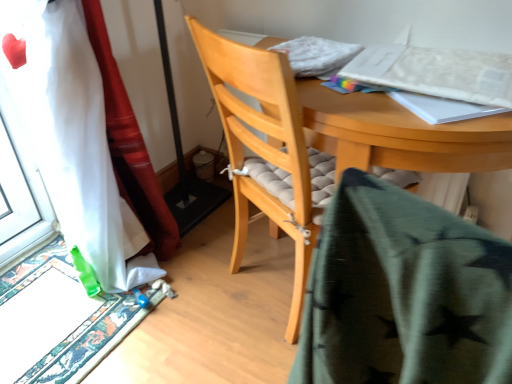
Question: From the image's perspective, is light wood chair at center under green star-patterned fabric at center?

Choices:
 (A) no
 (B) yes

Answer: (A)

Question: Is light wood chair at center shorter than green star-patterned fabric at center?

Choices:
 (A) no
 (B) yes

Answer: (A)

Question: From a real-world perspective, is light wood chair at center located higher than green star-patterned fabric at center?

Choices:
 (A) no
 (B) yes

Answer: (A)

Question: Is light wood chair at center behind green star-patterned fabric at center?

Choices:
 (A) no
 (B) yes

Answer: (B)

Question: From the image's perspective, is light wood chair at center on green star-patterned fabric at center?

Choices:
 (A) yes
 (B) no

Answer: (A)

Question: Considering the relative sizes of light wood chair at center and green star-patterned fabric at center in the image provided, is light wood chair at center bigger than green star-patterned fabric at center?

Choices:
 (A) no
 (B) yes

Answer: (B)

Question: Is white paper at upper right looking in the opposite direction of carpeted doormat at lower left?

Choices:
 (A) yes
 (B) no

Answer: (B)

Question: Considering the relative sizes of white paper at upper right and carpeted doormat at lower left in the image provided, is white paper at upper right bigger than carpeted doormat at lower left?

Choices:
 (A) no
 (B) yes

Answer: (A)

Question: From a real-world perspective, is white paper at upper right physically above carpeted doormat at lower left?

Choices:
 (A) yes
 (B) no

Answer: (A)

Question: Is white paper at upper right not inside carpeted doormat at lower left?

Choices:
 (A) no
 (B) yes

Answer: (B)

Question: From the image's perspective, is white paper at upper right on top of carpeted doormat at lower left?

Choices:
 (A) yes
 (B) no

Answer: (A)

Question: Does white paper at upper right have a smaller size compared to carpeted doormat at lower left?

Choices:
 (A) no
 (B) yes

Answer: (B)

Question: Could white paper at upper right be considered to be inside carpeted doormat at lower left?

Choices:
 (A) yes
 (B) no

Answer: (B)